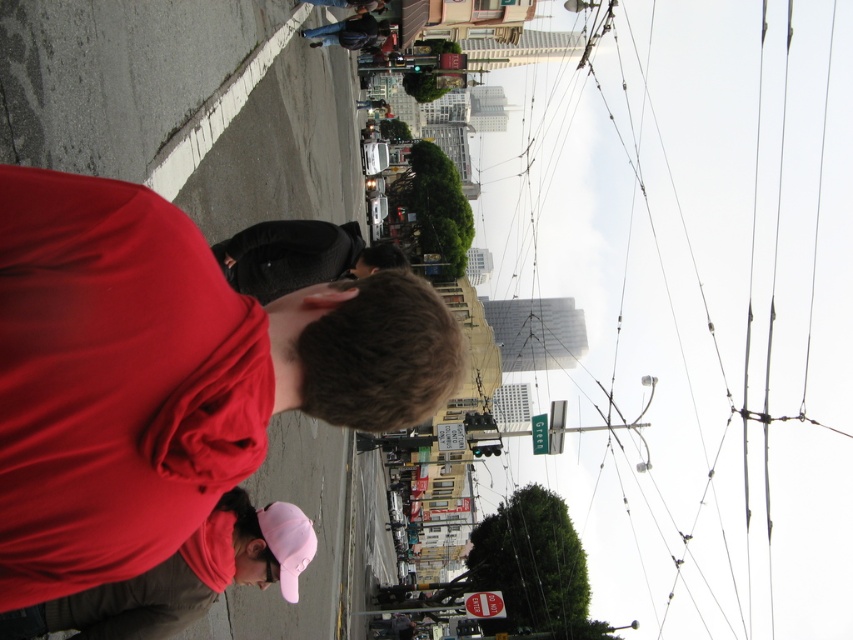
Question: Can you confirm if matte red shirt at center is smaller than black fabric hat at center?

Choices:
 (A) no
 (B) yes

Answer: (B)

Question: Among these points, which one is nearest to the camera?

Choices:
 (A) (363, 260)
 (B) (169, 300)

Answer: (B)

Question: Which point is farther to the camera?

Choices:
 (A) (421, 316)
 (B) (236, 256)

Answer: (B)

Question: In this image, where is matte red shirt at center located relative to black fabric hat at center?

Choices:
 (A) left
 (B) right

Answer: (A)

Question: Is matte red shirt at center closer to camera compared to black fabric hat at center?

Choices:
 (A) no
 (B) yes

Answer: (B)